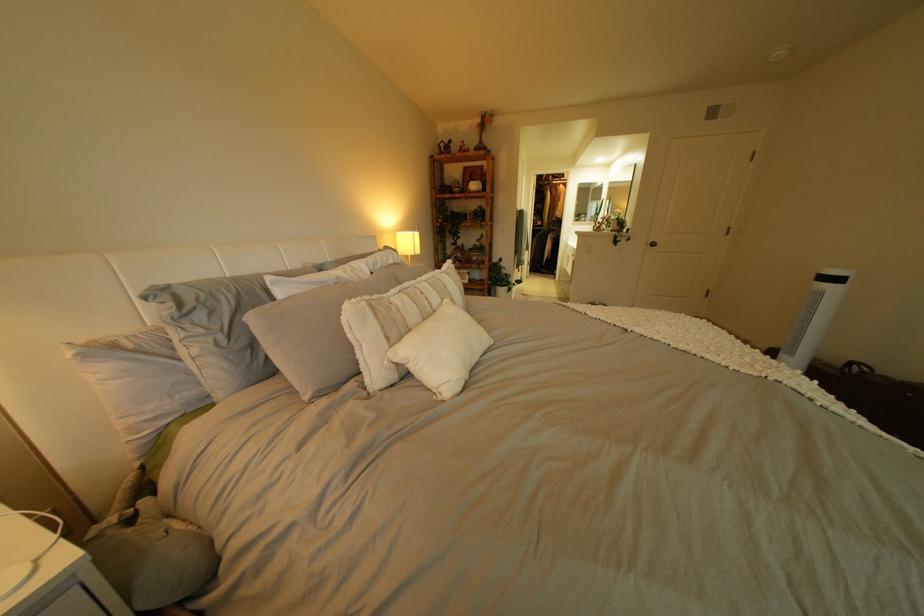
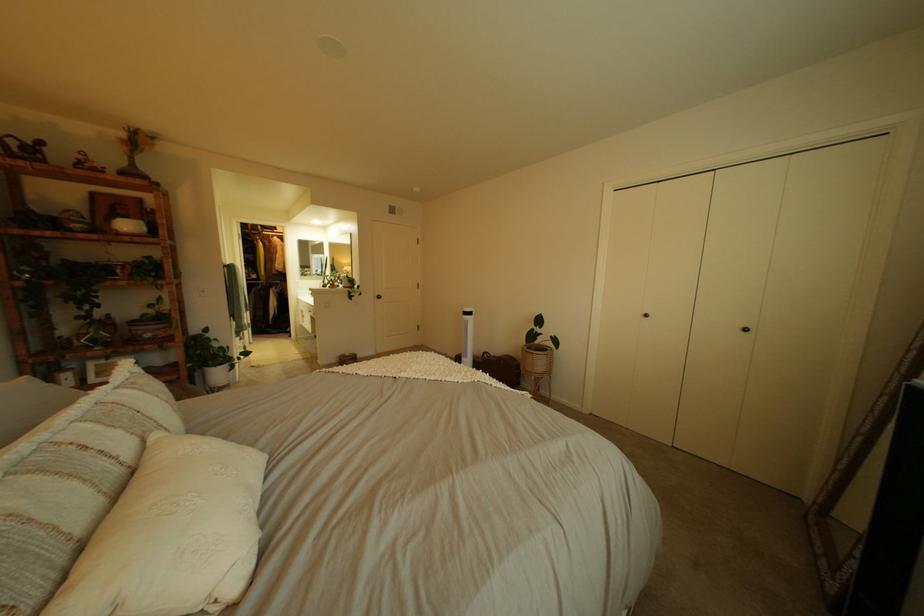
The point at [748,345] is marked in the first image. Where is the corresponding point in the second image?

(468, 365)